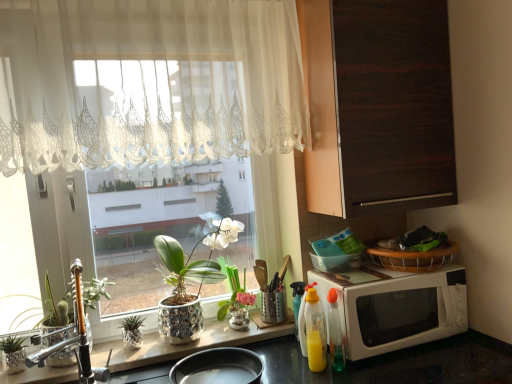
Question: Is silver textured pot at center, the 4th houseplant positioned from the left, next to white lace curtain at upper left?

Choices:
 (A) yes
 (B) no

Answer: (B)

Question: Is silver textured pot at center, the 2th houseplant viewed from the right, smaller than white lace curtain at upper left?

Choices:
 (A) yes
 (B) no

Answer: (A)

Question: Does silver textured pot at center, the 2th houseplant viewed from the right, have a greater height compared to white lace curtain at upper left?

Choices:
 (A) yes
 (B) no

Answer: (B)

Question: Can you confirm if silver textured pot at center, the 4th houseplant positioned from the left, is thinner than white lace curtain at upper left?

Choices:
 (A) yes
 (B) no

Answer: (B)

Question: Is silver textured pot at center, the 4th houseplant positioned from the left, far from white lace curtain at upper left?

Choices:
 (A) yes
 (B) no

Answer: (B)

Question: Is silver textured pot at center, the 4th houseplant positioned from the left, aimed at white lace curtain at upper left?

Choices:
 (A) no
 (B) yes

Answer: (A)

Question: Considering the relative sizes of matte silver pot at center, the fifth houseplant from the left, and yellow translucent spray bottle at center, the 1th bottle viewed from the back, in the image provided, is matte silver pot at center, the fifth houseplant from the left, shorter than yellow translucent spray bottle at center, the 1th bottle viewed from the back,?

Choices:
 (A) no
 (B) yes

Answer: (A)

Question: Is the position of matte silver pot at center, the 1th houseplant when ordered from right to left, less distant than that of yellow translucent spray bottle at center, which is the 4th bottle in front-to-back order?

Choices:
 (A) no
 (B) yes

Answer: (B)

Question: Can you confirm if matte silver pot at center, the fifth houseplant from the left, is positioned to the right of yellow translucent spray bottle at center, the 1th bottle viewed from the back?

Choices:
 (A) no
 (B) yes

Answer: (A)

Question: Could you tell me if matte silver pot at center, the 1th houseplant when ordered from right to left, is turned towards yellow translucent spray bottle at center, the 1th bottle viewed from the back?

Choices:
 (A) no
 (B) yes

Answer: (A)

Question: Is there a large distance between matte silver pot at center, the 1th houseplant when ordered from right to left, and yellow translucent spray bottle at center, which is the 4th bottle in front-to-back order?

Choices:
 (A) yes
 (B) no

Answer: (B)

Question: Is matte silver pot at center, the fifth houseplant from the left, with yellow translucent spray bottle at center, which is the 4th bottle in front-to-back order?

Choices:
 (A) no
 (B) yes

Answer: (A)

Question: From the image's perspective, is yellow plastic bottle at lower center, which is counted as the third bottle, starting from the front, above translucent plastic bottle at lower right, which is counted as the third bottle, starting from the back?

Choices:
 (A) yes
 (B) no

Answer: (A)